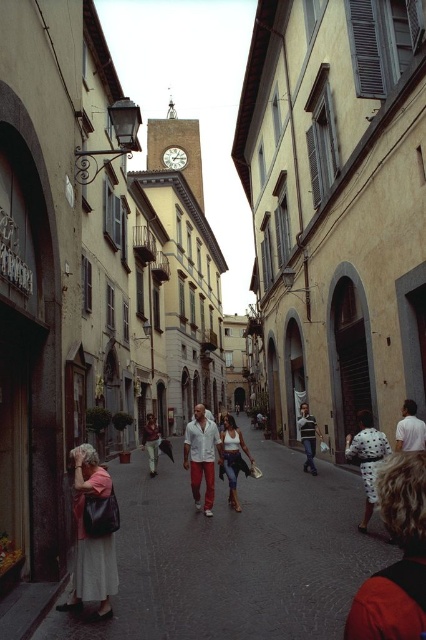
You are a photographer planning to capture a group photo of the people in the scene. You need to ensure everyone fits within the camera frame. Considering the white cotton dress at lower left and the striped cotton shirt at center, which of these two items might require more space due to their size?

The white cotton dress at lower left might require more space because it might be wider than the striped cotton shirt at center.

You are a tailor observing a street scene and notice two garments. The fluffy fur coat at lower right and the white cotton shirt at center. Which garment is taller?

The fluffy fur coat at lower right is taller than the white cotton shirt at center.

You are a tailor observing the street scene and notice two garments. The fluffy fur coat at lower right and the white cotton shirt at center. Which garment appears to be larger in size?

The white cotton shirt at center is larger than the fluffy fur coat at lower right.